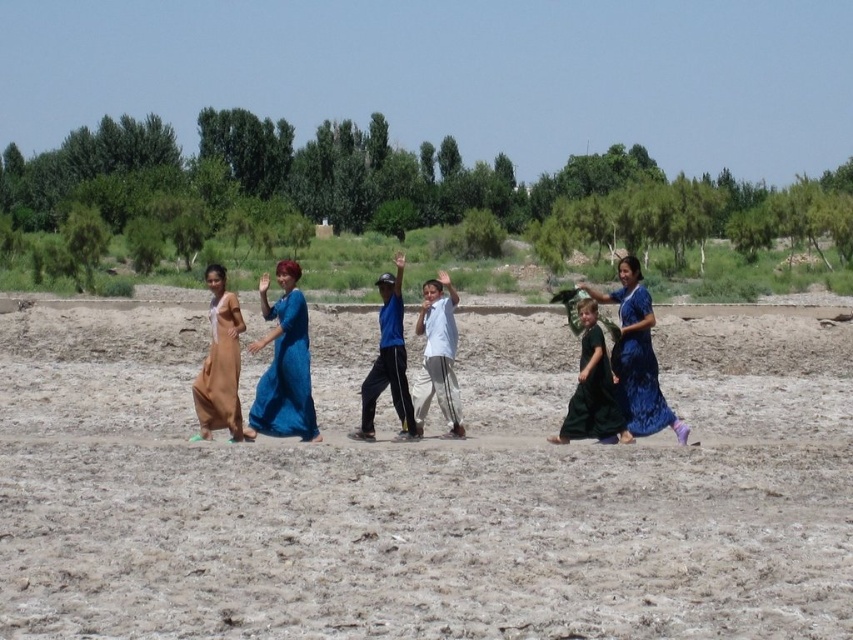
Does blue textured dress at center come behind blue fabric pants at center?

No, it is in front of blue fabric pants at center.

Locate an element on the screen. This screenshot has width=853, height=640. blue textured dress at center is located at coordinates (637, 355).

Find the location of a particular element. The image size is (853, 640). blue textured dress at center is located at coordinates (637, 355).

Can you confirm if matte brown dress at left is smaller than blue satin dress at right?

No, matte brown dress at left is not smaller than blue satin dress at right.

Who is positioned more to the right, matte brown dress at left or blue satin dress at right?

blue satin dress at right

Does point (233, 404) lie behind point (647, 384)?

No.

At what (x,y) coordinates should I click in order to perform the action: click on matte brown dress at left. Please return your answer as a coordinate pair (x, y). Looking at the image, I should click on (219, 364).

Between point (631, 321) and point (593, 340), which one is positioned behind?

The point (631, 321) is behind.

Based on the photo, is blue textured dress at center bigger than dark green dress at center?

Correct, blue textured dress at center is larger in size than dark green dress at center.

The width and height of the screenshot is (853, 640). In order to click on blue textured dress at center in this screenshot , I will do `click(637, 355)`.

Locate an element on the screen. blue textured dress at center is located at coordinates point(637,355).